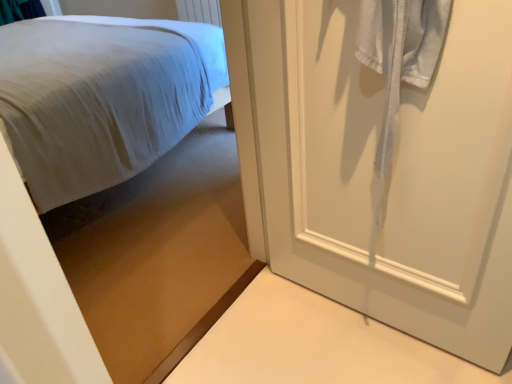
You are a GUI agent. You are given a task and a screenshot of the screen. Output one action in this format:
    pyautogui.click(x=<x>, y=<y>)
    Task: Click on the white matte door at right
    
    Given the screenshot: What is the action you would take?
    pyautogui.click(x=373, y=169)

The width and height of the screenshot is (512, 384). Describe the element at coordinates (101, 98) in the screenshot. I see `white fabric bed at left, marked as the second bed in a front-to-back arrangement` at that location.

In order to click on white matte door at right in this screenshot , I will do `click(373, 169)`.

At what (x,y) coordinates should I click in order to perform the action: click on door that is below the white fabric bed at left, marked as the second bed in a front-to-back arrangement (from the image's perspective). Please return your answer as a coordinate pair (x, y). This screenshot has width=512, height=384. Looking at the image, I should click on point(373,169).

From a real-world perspective, between white matte door at right and white fabric bed at left, marked as the second bed in a front-to-back arrangement, who is vertically lower?

From a 3D spatial view, white fabric bed at left, marked as the second bed in a front-to-back arrangement, is below.

Does white matte door at right turn towards white fabric bed at left, marked as the second bed in a front-to-back arrangement?

No, white matte door at right is not oriented towards white fabric bed at left, marked as the second bed in a front-to-back arrangement.

Visually, is white matte door at right positioned to the left or to the right of white fabric bed at left, marked as the second bed in a front-to-back arrangement?

In the image, white matte door at right appears on the right side of white fabric bed at left, marked as the second bed in a front-to-back arrangement.

Can we say white fabric bed at left, marked as the second bed in a front-to-back arrangement, lies outside matte white bed at upper left, which is the first bed in front-to-back order?

white fabric bed at left, marked as the second bed in a front-to-back arrangement, lies outside matte white bed at upper left, which is the first bed in front-to-back order,'s area.

How much distance is there between white fabric bed at left, marked as the second bed in a front-to-back arrangement, and matte white bed at upper left, which is the first bed in front-to-back order?

They are 17.32 inches apart.

Does white fabric bed at left, marked as the second bed in a front-to-back arrangement, lie behind matte white bed at upper left, the second bed from the back?

Yes, it is behind matte white bed at upper left, the second bed from the back.

Based on the photo, from a real-world perspective, is white fabric bed at left, which is counted as the first bed, starting from the back, positioned above or below matte white bed at upper left, the second bed from the back?

In terms of real-world spatial position, white fabric bed at left, which is counted as the first bed, starting from the back, is below matte white bed at upper left, the second bed from the back.

This screenshot has height=384, width=512. Identify the location of door that is on the right side of white fabric bed at left, which is counted as the first bed, starting from the back. (373, 169).

Can you tell me how much white fabric bed at left, which is counted as the first bed, starting from the back, and white matte door at right differ in facing direction?

They differ by 178 degrees in their facing directions.

Would you say white fabric bed at left, which is counted as the first bed, starting from the back, contains white matte door at right?

No.

Looking at their sizes, would you say white fabric bed at left, which is counted as the first bed, starting from the back, is wider or thinner than white matte door at right?

Clearly, white fabric bed at left, which is counted as the first bed, starting from the back, has more width compared to white matte door at right.

Does matte white bed at upper left, which is the first bed in front-to-back order, lie in front of white matte door at right?

Yes, it is.

The image size is (512, 384). Identify the location of bed located above the white matte door at right (from a real-world perspective). (158, 255).

Is matte white bed at upper left, which is the first bed in front-to-back order, next to white matte door at right?

No, matte white bed at upper left, which is the first bed in front-to-back order, is not with white matte door at right.

What's the angular difference between white matte door at right and matte white bed at upper left, the second bed from the back,'s facing directions?

They differ by 94.4 degrees in their facing directions.

From the picture: Is white matte door at right next to matte white bed at upper left, the second bed from the back, and touching it?

white matte door at right and matte white bed at upper left, the second bed from the back, are clearly separated.

Does white matte door at right have a greater height compared to matte white bed at upper left, which is the first bed in front-to-back order?

No, white matte door at right is not taller than matte white bed at upper left, which is the first bed in front-to-back order.

From a real-world perspective, which object rests below the other?

white matte door at right, from a real-world perspective.

Considering the sizes of objects matte white bed at upper left, which is the first bed in front-to-back order, and white fabric bed at left, marked as the second bed in a front-to-back arrangement, in the image provided, who is taller, matte white bed at upper left, which is the first bed in front-to-back order, or white fabric bed at left, marked as the second bed in a front-to-back arrangement,?

With more height is matte white bed at upper left, which is the first bed in front-to-back order.

Do you think matte white bed at upper left, the second bed from the back, is within white fabric bed at left, marked as the second bed in a front-to-back arrangement, or outside of it?

matte white bed at upper left, the second bed from the back, exists outside the volume of white fabric bed at left, marked as the second bed in a front-to-back arrangement.

Could you tell me if matte white bed at upper left, which is the first bed in front-to-back order, is facing white fabric bed at left, marked as the second bed in a front-to-back arrangement?

No, matte white bed at upper left, which is the first bed in front-to-back order, is not turned towards white fabric bed at left, marked as the second bed in a front-to-back arrangement.

Between matte white bed at upper left, the second bed from the back, and white fabric bed at left, marked as the second bed in a front-to-back arrangement, which one has smaller width?

Thinner between the two is matte white bed at upper left, the second bed from the back.

Identify the location of door above the white fabric bed at left, marked as the second bed in a front-to-back arrangement (from a real-world perspective). This screenshot has height=384, width=512. (373, 169).

In the image, there is a matte white bed at upper left, the second bed from the back. At what (x,y) coordinates should I click in order to perform the action: click on bed below it (from a real-world perspective). Please return your answer as a coordinate pair (x, y). Looking at the image, I should click on (101, 98).

Considering their positions, is matte white bed at upper left, which is the first bed in front-to-back order, positioned further to white matte door at right than white fabric bed at left, which is counted as the first bed, starting from the back?

white fabric bed at left, which is counted as the first bed, starting from the back, is further to white matte door at right.

Based on their spatial positions, is white matte door at right or white fabric bed at left, marked as the second bed in a front-to-back arrangement, further from matte white bed at upper left, the second bed from the back?

Based on the image, white matte door at right appears to be further to matte white bed at upper left, the second bed from the back.

When comparing their distances from white matte door at right, does white fabric bed at left, which is counted as the first bed, starting from the back, or matte white bed at upper left, which is the first bed in front-to-back order, seem closer?

matte white bed at upper left, which is the first bed in front-to-back order, lies closer to white matte door at right than the other object.

Looking at the image, which one is located closer to matte white bed at upper left, the second bed from the back, white fabric bed at left, which is counted as the first bed, starting from the back, or white matte door at right?

Based on the image, white fabric bed at left, which is counted as the first bed, starting from the back, appears to be nearer to matte white bed at upper left, the second bed from the back.

From the image, which object appears to be farther from white fabric bed at left, which is counted as the first bed, starting from the back, white matte door at right or matte white bed at upper left, which is the first bed in front-to-back order?

Based on the image, white matte door at right appears to be further to white fabric bed at left, which is counted as the first bed, starting from the back.

Looking at the image, which one is located further to white fabric bed at left, which is counted as the first bed, starting from the back, matte white bed at upper left, which is the first bed in front-to-back order, or white matte door at right?

white matte door at right is further to white fabric bed at left, which is counted as the first bed, starting from the back.

Where is `bed between white fabric bed at left, marked as the second bed in a front-to-back arrangement, and white matte door at right, in the horizontal direction`? The width and height of the screenshot is (512, 384). bed between white fabric bed at left, marked as the second bed in a front-to-back arrangement, and white matte door at right, in the horizontal direction is located at coordinates (158, 255).